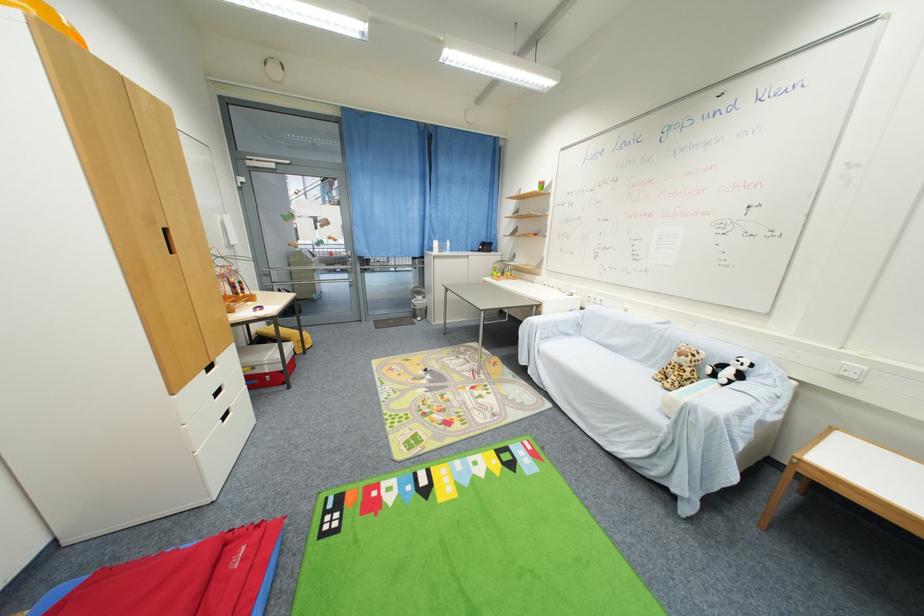
Where would you play the bead maze toy? Please return your answer as a coordinate pair (x, y).

(679, 368)